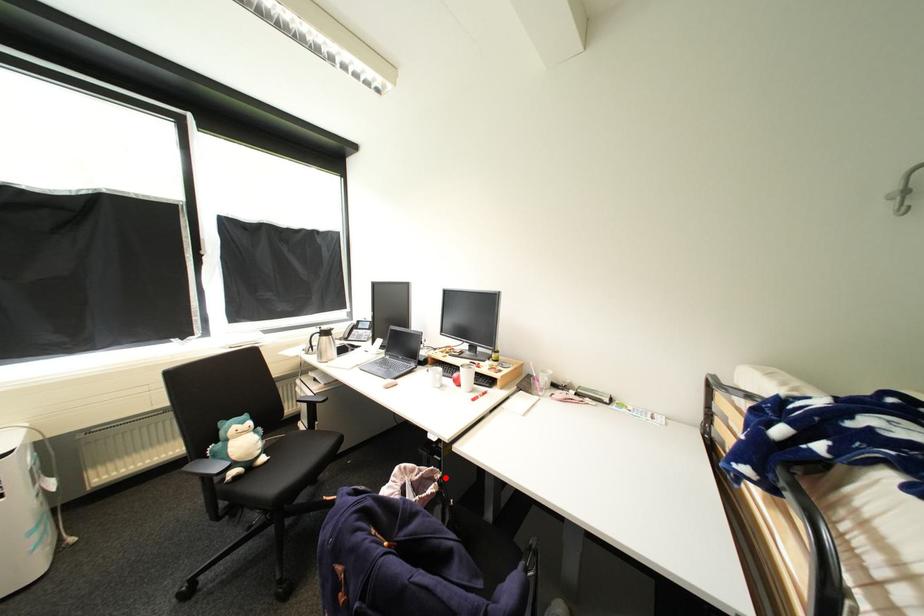
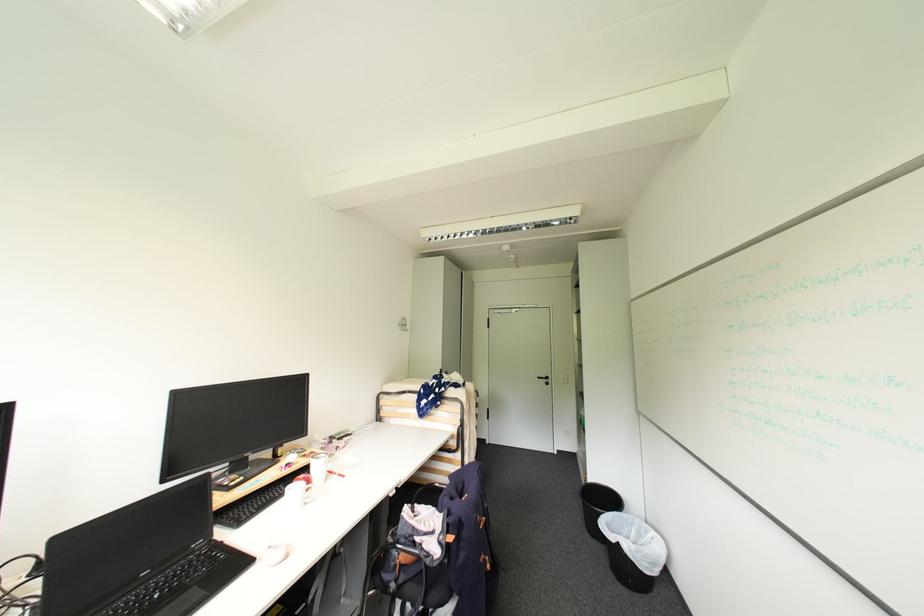
Question: I am providing you with two images of the same scene from different viewpoints. Image1 has a red point marked. In image2, the corresponding 3D location appears at what relative position? Reply with the corresponding letter.

Choices:
 (A) Closer
 (B) Farther

Answer: (A)